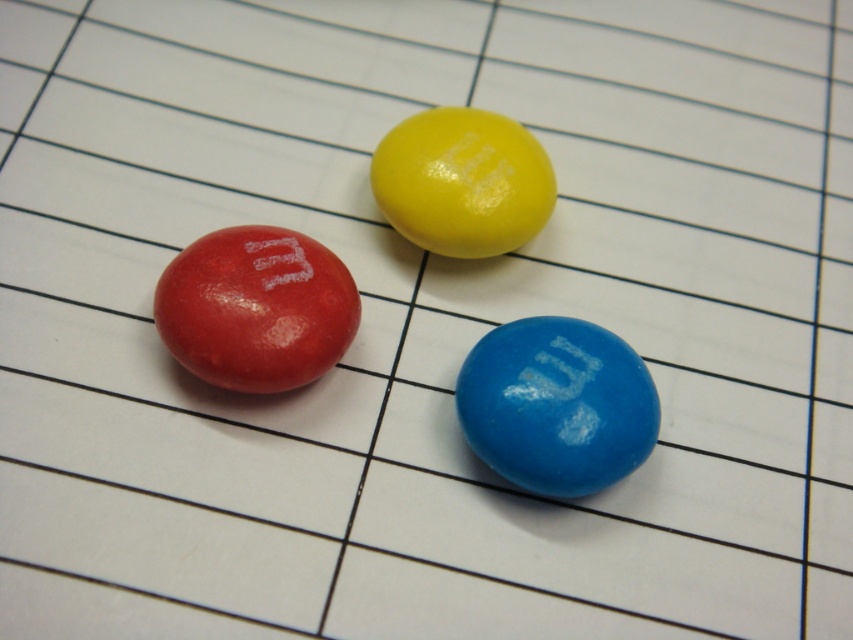
Which is more to the left, matte red m&m at upper left or glossy yellow m&m at upper center?

matte red m&m at upper left

Is point (241, 266) positioned behind point (473, 150)?

No, (241, 266) is in front of (473, 150).

Find the location of `matte red m&m at upper left`. matte red m&m at upper left is located at coordinates (256, 308).

Does blue glossy m&m at center appear on the left side of matte red m&m at upper left?

Incorrect, blue glossy m&m at center is not on the left side of matte red m&m at upper left.

Consider the image. Does blue glossy m&m at center appear on the right side of matte red m&m at upper left?

Yes, blue glossy m&m at center is to the right of matte red m&m at upper left.

Between point (479, 346) and point (171, 336), which one is positioned behind?

Point (479, 346)

Identify the location of blue glossy m&m at center. (556, 404).

Does blue glossy m&m at center have a smaller size compared to glossy yellow m&m at upper center?

No, blue glossy m&m at center is not smaller than glossy yellow m&m at upper center.

Who is more forward, (602, 477) or (512, 182)?

Point (602, 477)

At what (x,y) coordinates should I click in order to perform the action: click on blue glossy m&m at center. Please return your answer as a coordinate pair (x, y). The height and width of the screenshot is (640, 853). Looking at the image, I should click on (556, 404).